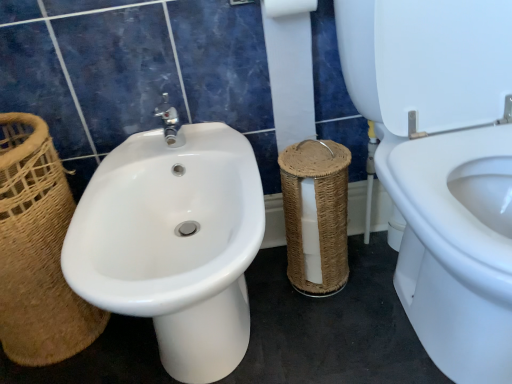
Where is `vacant area that lies to the right of woven brown basket at center`? The image size is (512, 384). vacant area that lies to the right of woven brown basket at center is located at coordinates (379, 272).